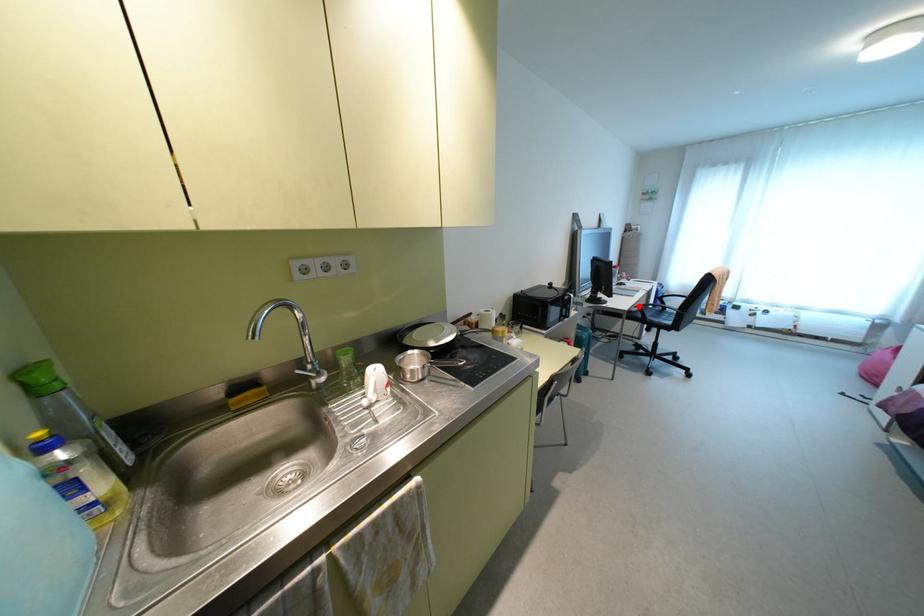
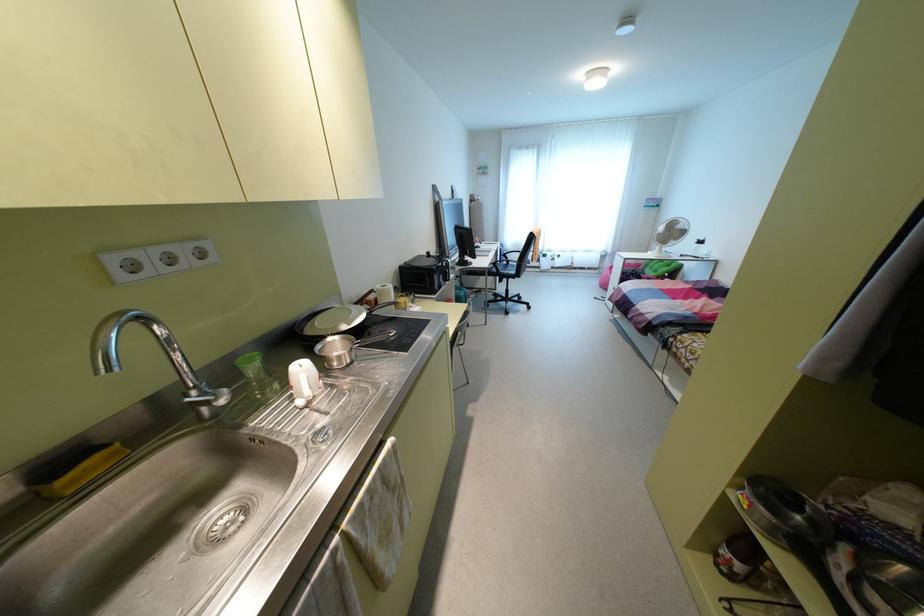
Question: I am providing you with two images of the same scene from different viewpoints. A red point is shown in image1. For the corresponding object point in image2, is it positioned nearer or farther from the camera?

Choices:
 (A) Nearer
 (B) Farther

Answer: (A)